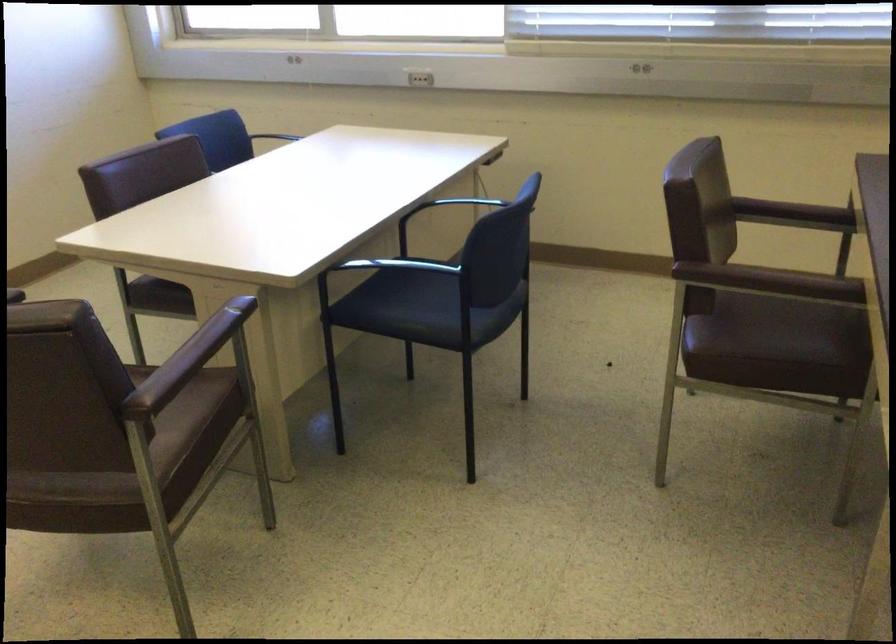
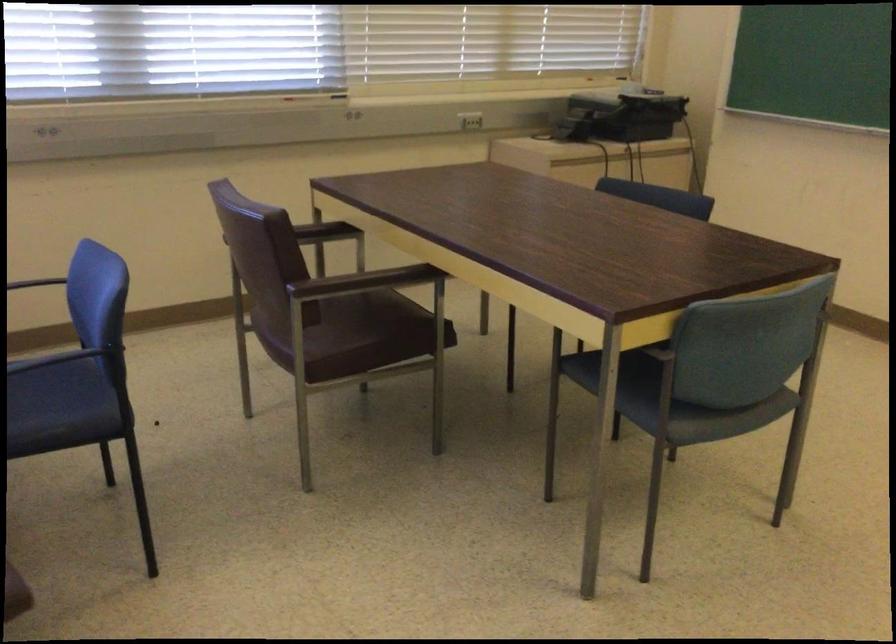
Find the pixel in the second image that matches [820,212] in the first image.

(323, 232)